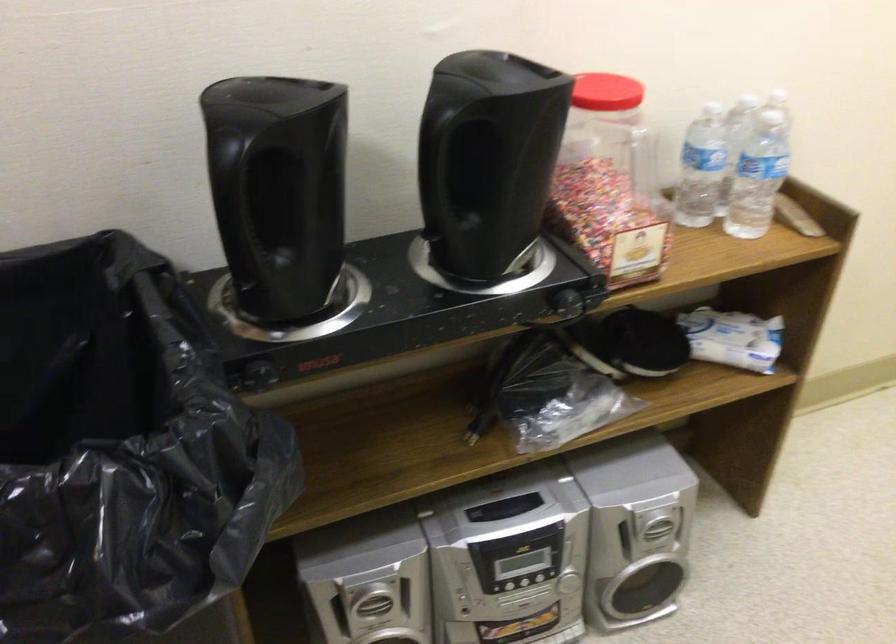
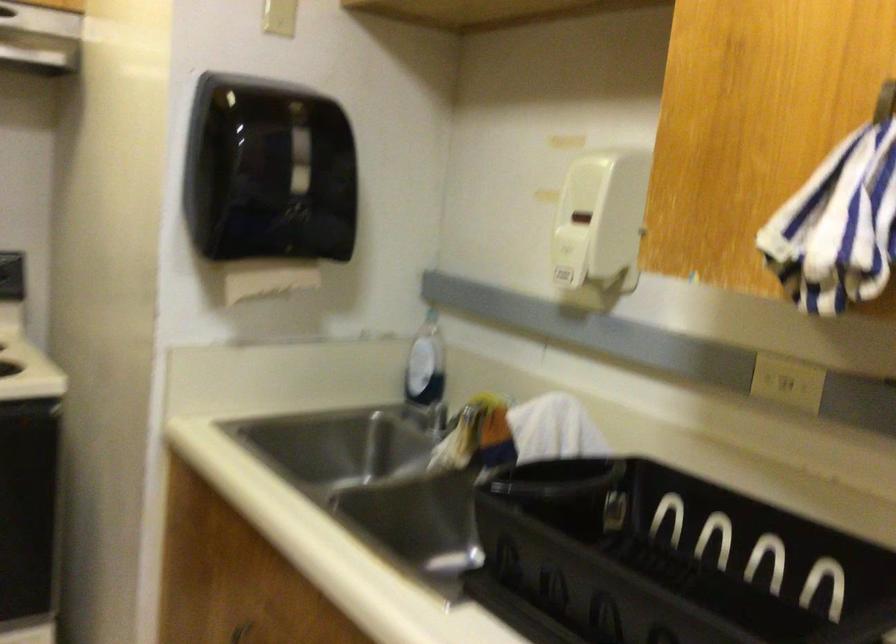
Question: The camera is either moving clockwise (left) or counter-clockwise (right) around the object. The first image is from the beginning of the video and the second image is from the end. Is the camera moving left or right when shooting the video?

Choices:
 (A) Left
 (B) Right

Answer: (B)